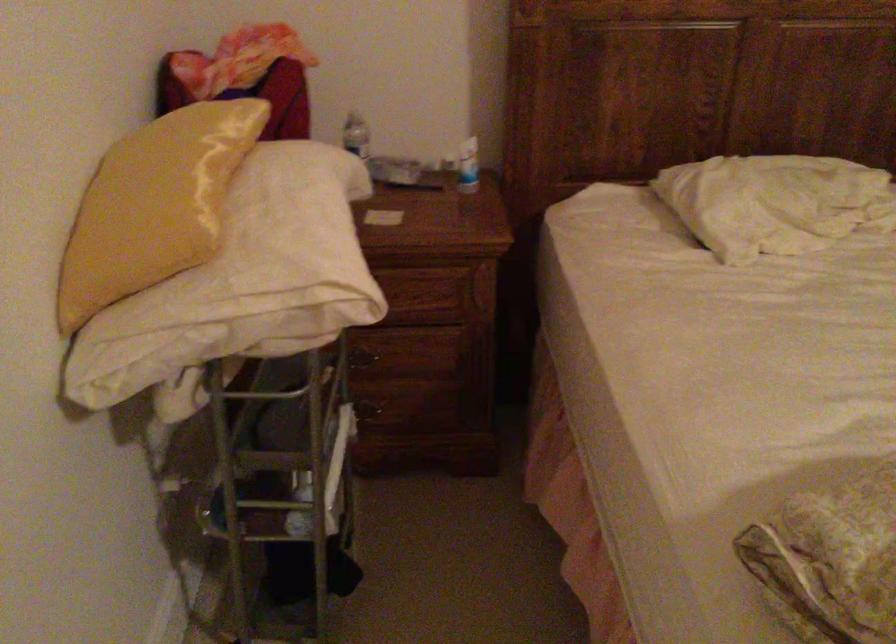
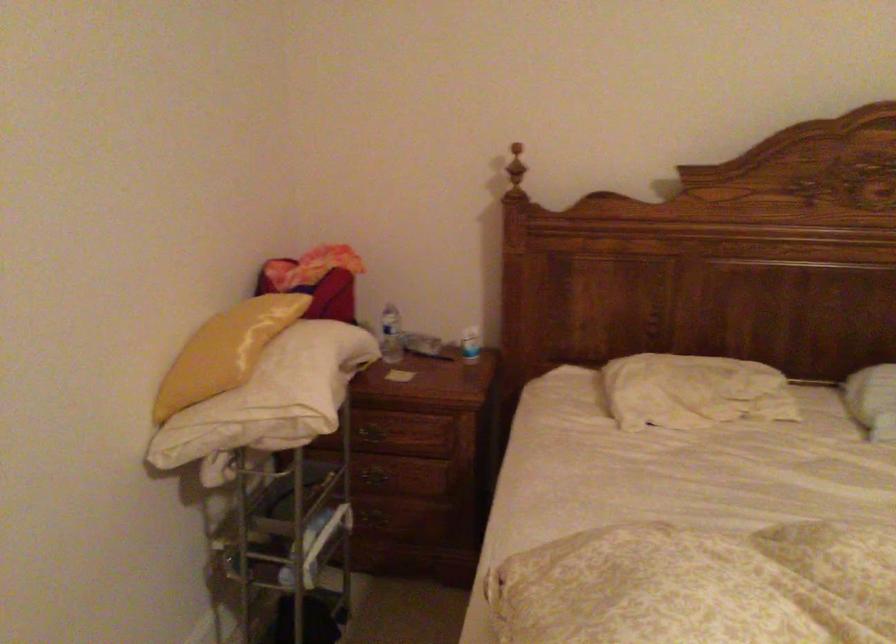
Where in the second image is the point corresponding to [286,232] from the first image?

(287, 375)